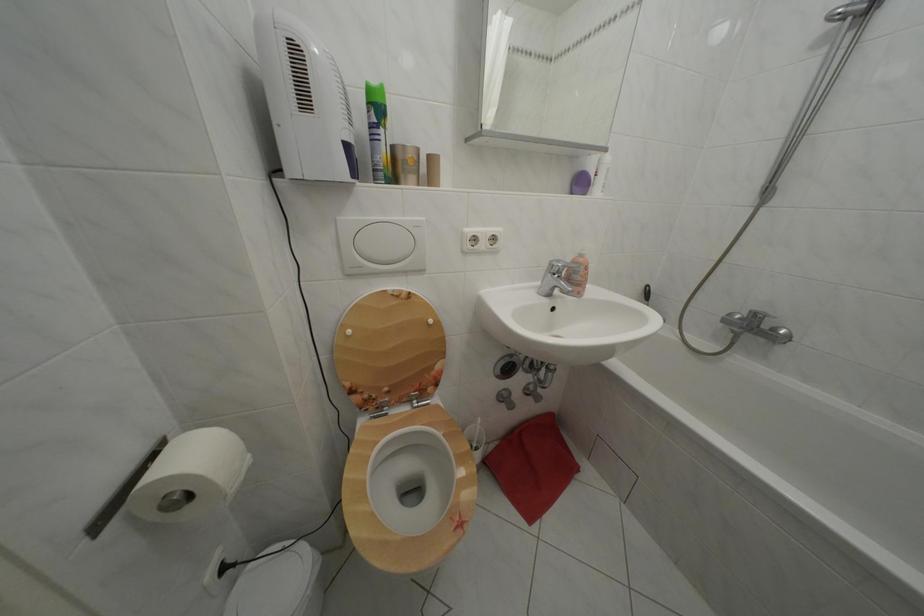
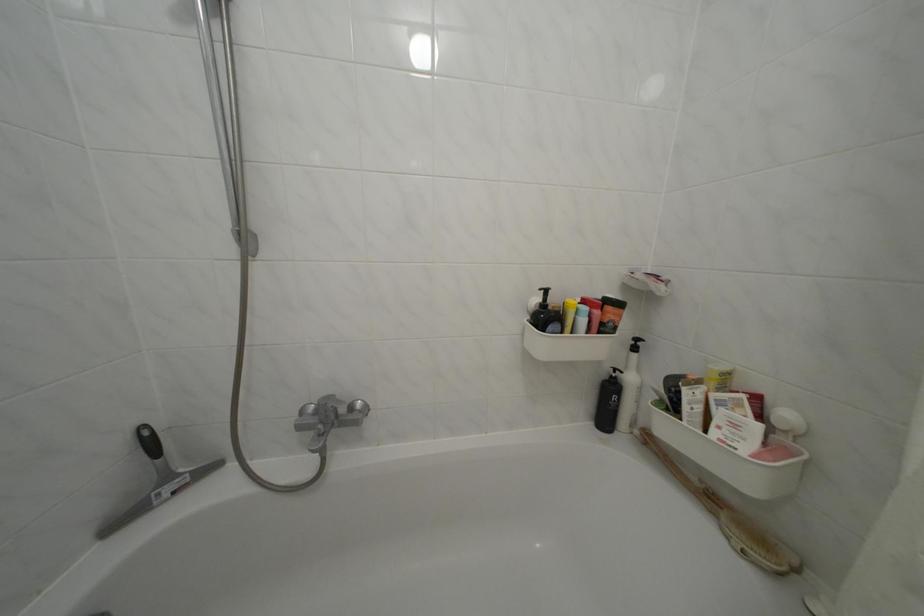
Locate, in the second image, the point that corresponds to (x=783, y=336) in the first image.

(359, 414)